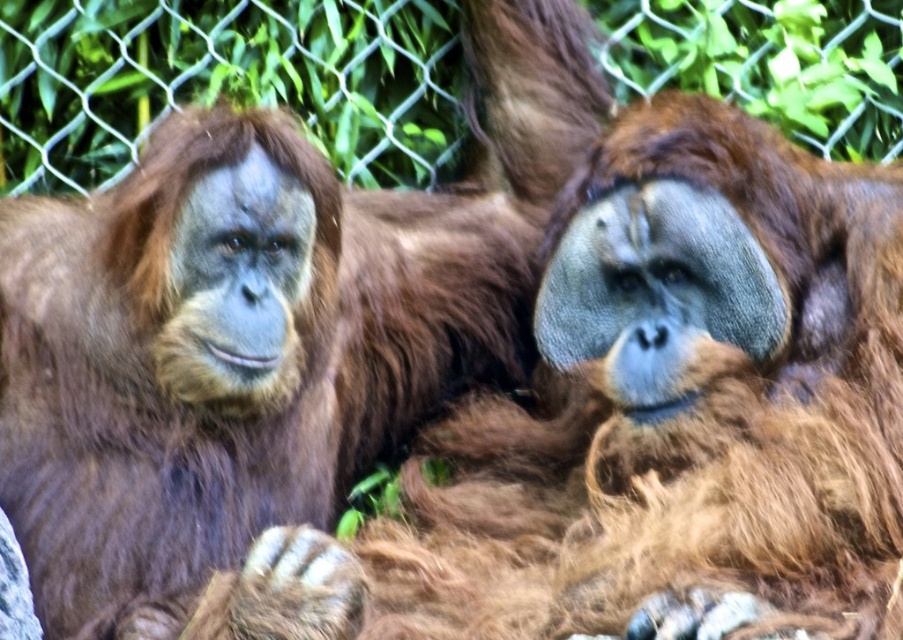
From the picture: You are a wildlife photographer trying to capture a photo of the brown furry orangutan at center and the wire mesh fence at upper center. Which object should you focus on first if you want to ensure both are in the frame without moving the camera?

The brown furry orangutan at center is bigger than the wire mesh fence at upper center, so you should focus on the brown furry orangutan at center first to ensure both fit in the frame.

You are an animal caretaker standing in front of the brown furry orangutan at center and the wire mesh fence at upper center. You need to place a banana between them so that it is closer to the orangutan than the fence. Where should you place the banana?

The brown furry orangutan at center is closer to the viewer than the wire mesh fence at upper center. Therefore, placing the banana between them near the brown furry orangutan at center will ensure it is closer to the orangutan than the fence.